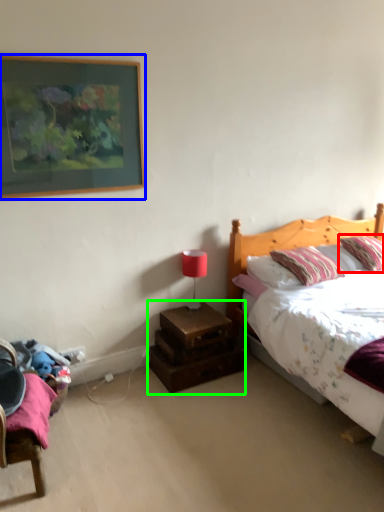
Question: Which object is the closest to the pillow (highlighted by a red box)? Choose among these: picture frame (highlighted by a blue box) or nightstand (highlighted by a green box).

Choices:
 (A) picture frame
 (B) nightstand

Answer: (B)